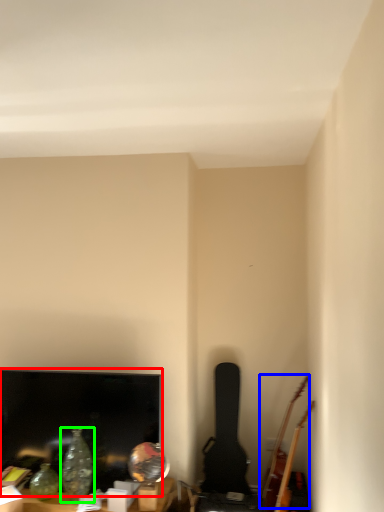
Question: Based on their relative distances, which object is nearer to television (highlighted by a red box)? Choose from guitar (highlighted by a blue box) and glass vase (highlighted by a green box).

Choices:
 (A) guitar
 (B) glass vase

Answer: (B)